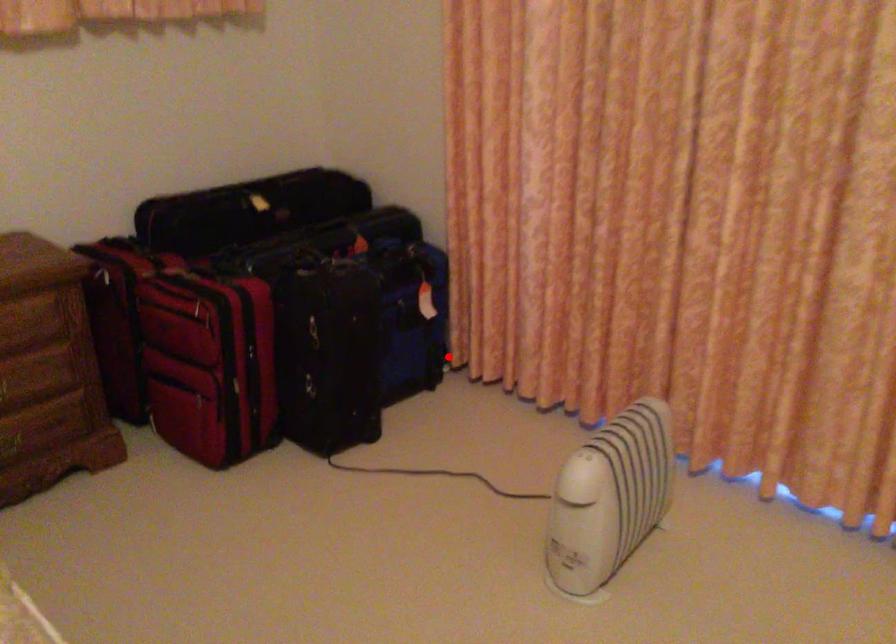
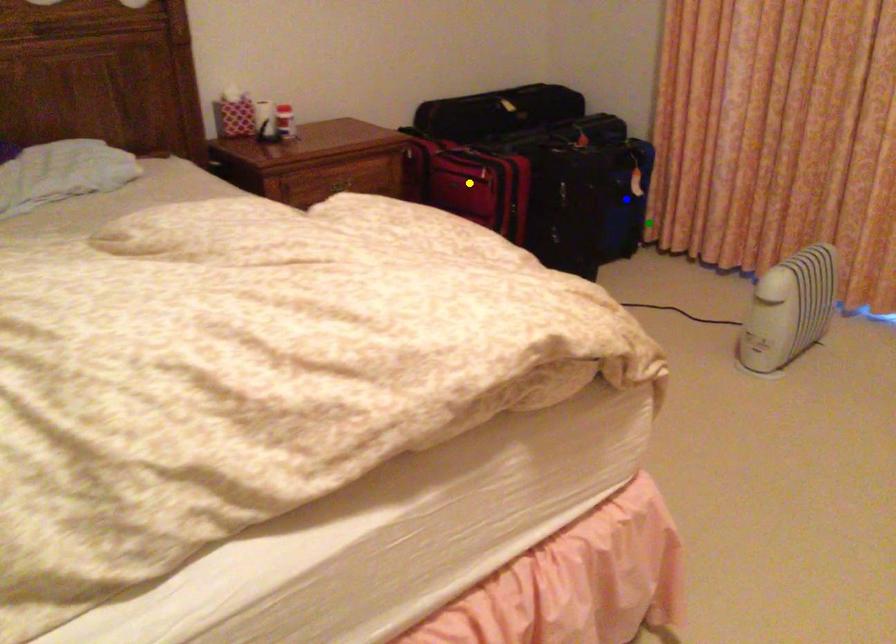
Question: I am providing you with two images of the same scene from different viewpoints. A red point is marked on the first image. You are given multiple points on the second image. Which mark in image 2 goes with the point in image 1?

Choices:
 (A) blue point
 (B) yellow point
 (C) green point

Answer: (C)